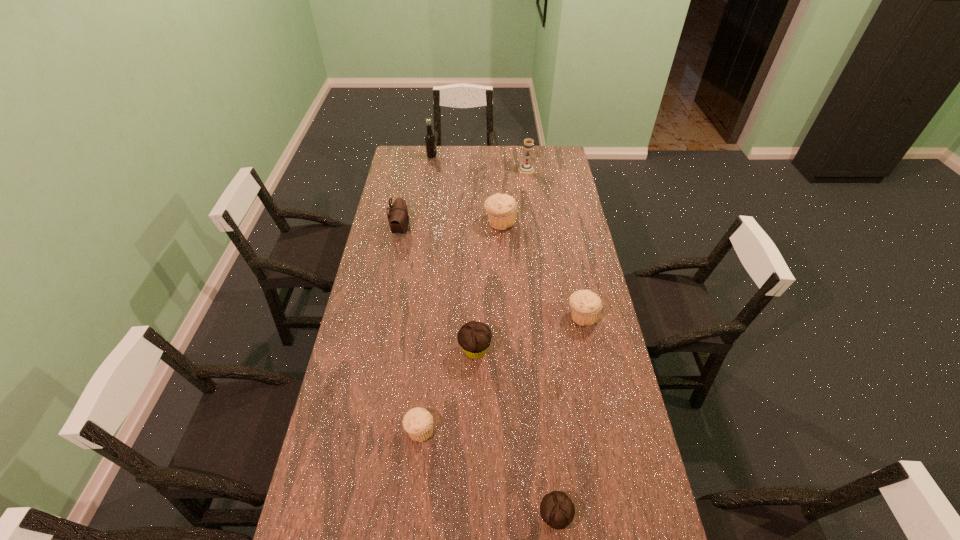
I want to click on the left chocolate muffin, so click(x=474, y=337).

This screenshot has height=540, width=960. I want to click on the bigger chocolate muffin, so click(474, 337).

I want to click on the seventh farthest object, so click(418, 422).

You are a GUI agent. You are given a task and a screenshot of the screen. Output one action in this format:
    pyautogui.click(x=<x>, y=<y>)
    Task: Click on the nearest beige muffin
    The height and width of the screenshot is (540, 960).
    Given the screenshot: What is the action you would take?
    pyautogui.click(x=418, y=422)

Find the location of a particular element. Image resolution: width=960 pixels, height=540 pixels. the smaller chocolate muffin is located at coordinates (557, 510).

Locate an element on the screen. This screenshot has height=540, width=960. the nearest muffin is located at coordinates (557, 510).

This screenshot has width=960, height=540. In order to click on free space located on the label of the tallest object in this screenshot , I will do `click(499, 157)`.

Locate an element on the screen. free space located on the left of the gray chalice is located at coordinates (493, 170).

Where is `blank space located 0.160m with the flap open on the leftmost object`? blank space located 0.160m with the flap open on the leftmost object is located at coordinates pos(446,230).

Locate an element on the screen. Image resolution: width=960 pixels, height=540 pixels. free spot located 0.310m on the front of the second beige muffin from left to right is located at coordinates (503, 284).